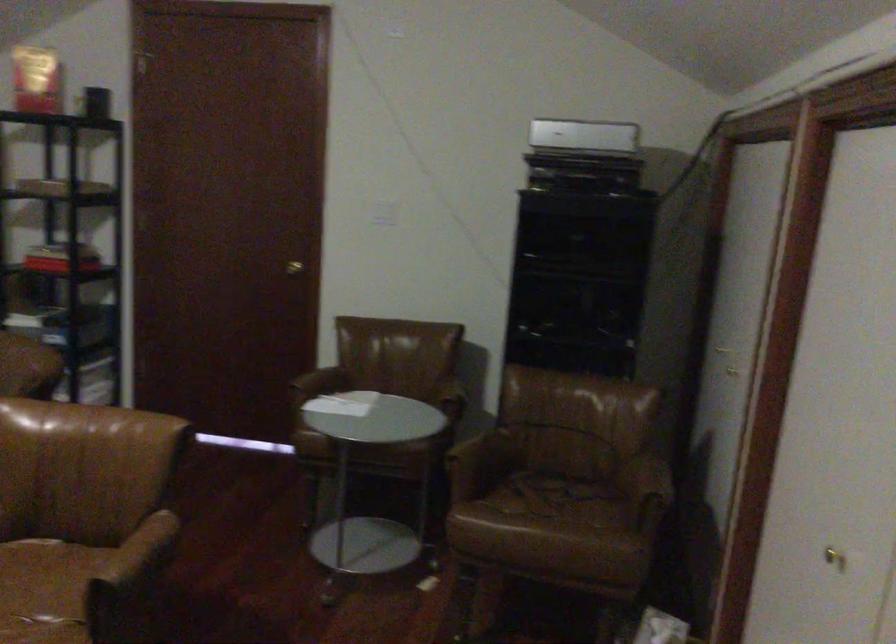
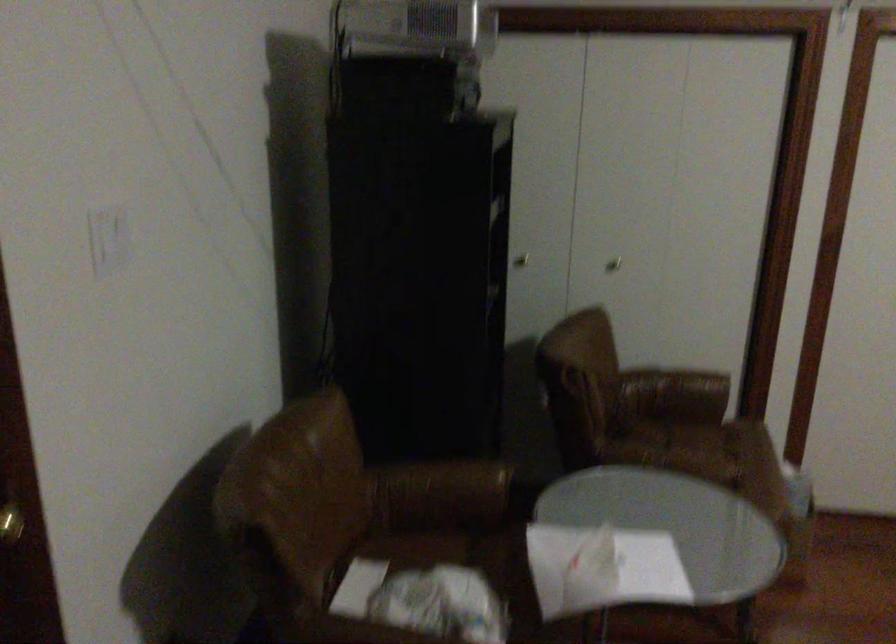
Find the pixel in the second image that matches [591,529] in the first image.

(718, 442)